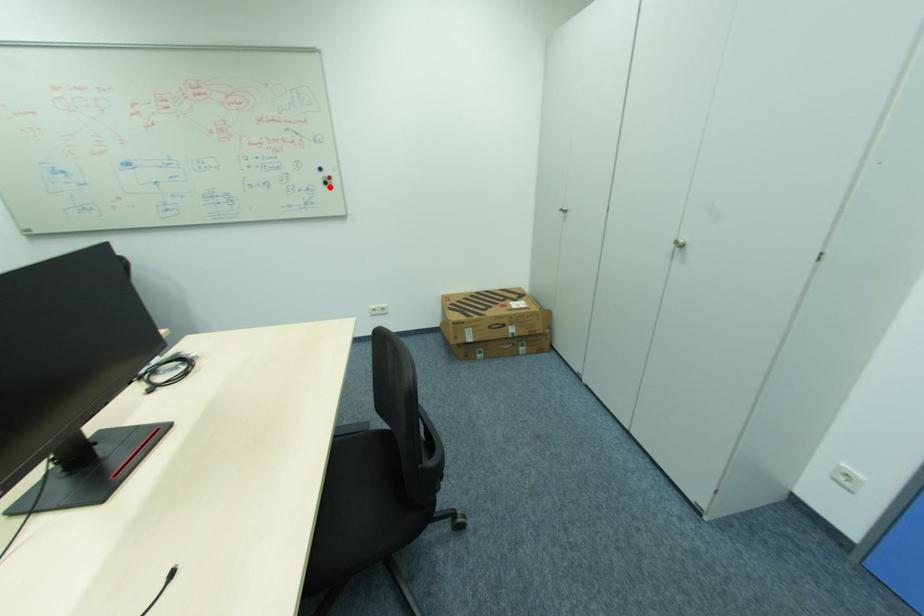
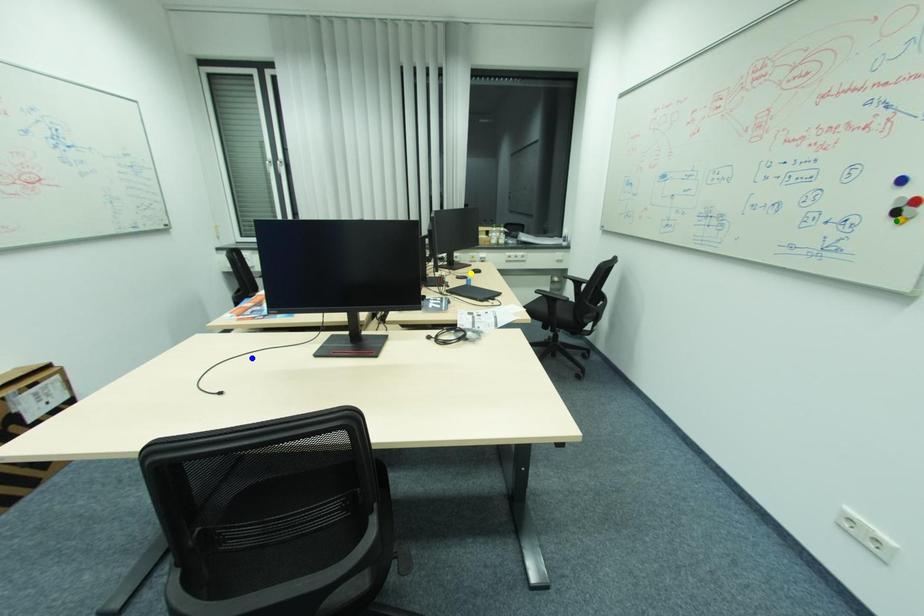
Question: I am providing you with two images of the same scene from different viewpoints. A red point is marked on the first image. You are given multiple points on the second image. In image 2, which mark is for the same physical point as the one in image 1?

Choices:
 (A) yellow point
 (B) blue point
 (C) green point

Answer: (C)